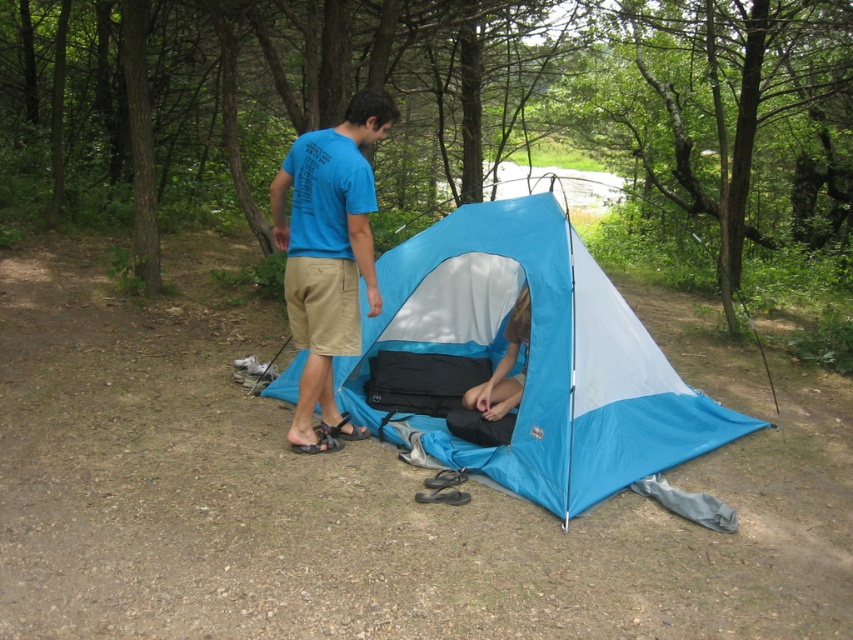
You are planning to set up a tent in this camping area. You have two tents available, the blue tarpaulin tent at center and the blue fabric tent at center. Which one would you choose if you want the bigger one for more space?

The blue tarpaulin tent at center is larger in size than the blue fabric tent at center, so you should choose the blue tarpaulin tent at center for more space.